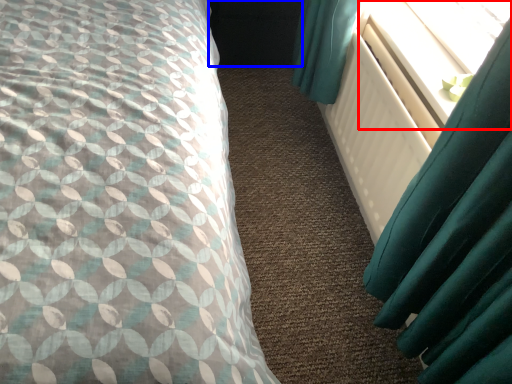
Question: Which of the following is the closest to the observer, window screen (highlighted by a red box) or dark (highlighted by a blue box)?

Choices:
 (A) window screen
 (B) dark

Answer: (A)